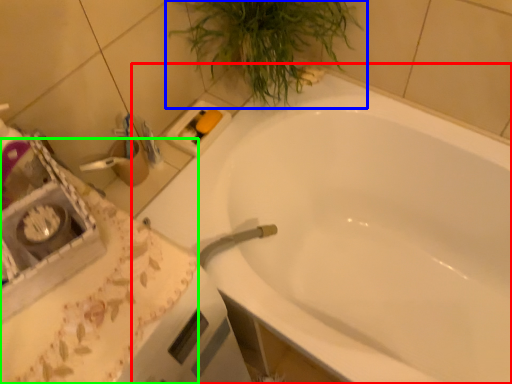
Question: Considering the real-world distances, which object is farthest from bathtub (highlighted by a red box)? houseplant (highlighted by a blue box) or counter top (highlighted by a green box)?

Choices:
 (A) houseplant
 (B) counter top

Answer: (B)